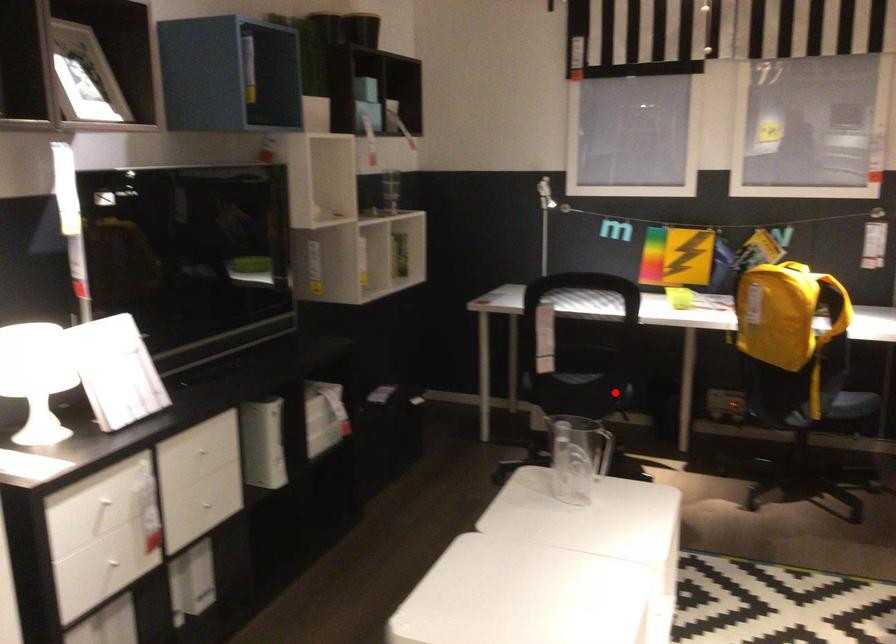
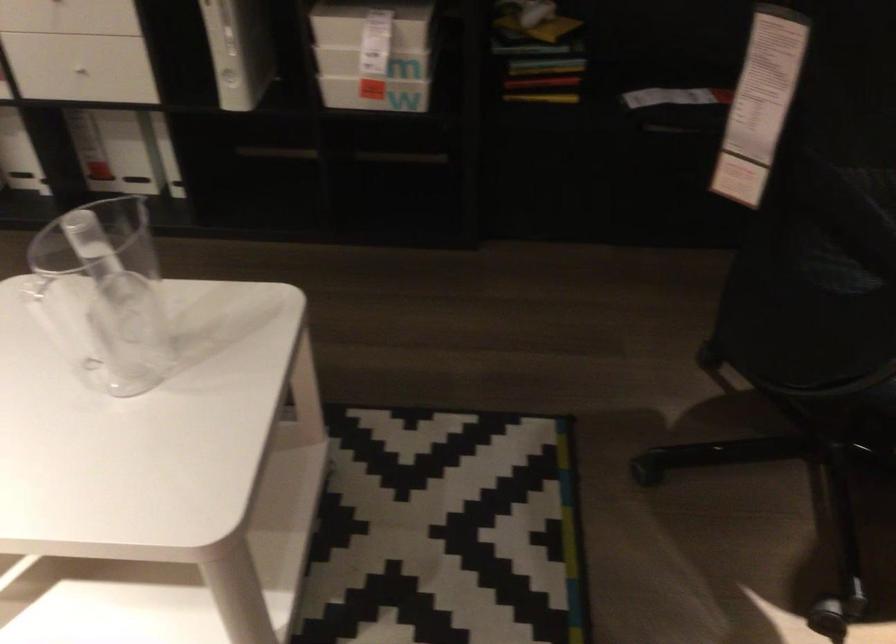
Question: I am providing you with two images of the same scene from different viewpoints. A red point is shown in image1. For the corresponding object point in image2, is it positioned nearer or farther from the camera?

Choices:
 (A) Nearer
 (B) Farther

Answer: (A)